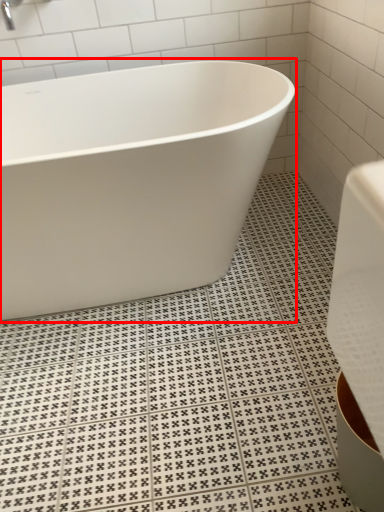
Question: In this image, where is bathtub (annotated by the red box) located relative to faucet?

Choices:
 (A) right
 (B) left

Answer: (A)